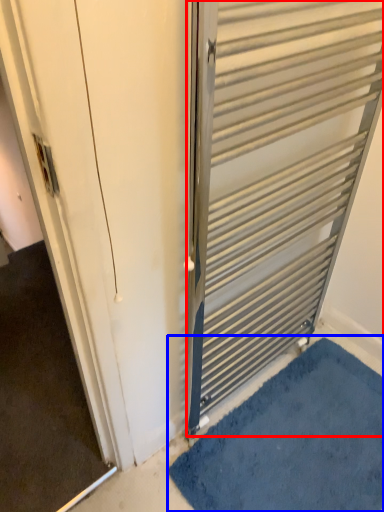
Question: Which object is further to the camera taking this photo, door (highlighted by a red box) or bath mat (highlighted by a blue box)?

Choices:
 (A) door
 (B) bath mat

Answer: (B)